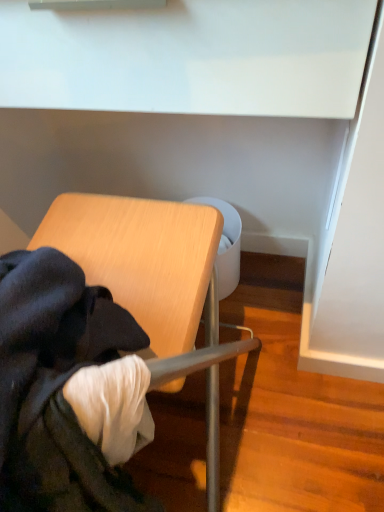
This screenshot has height=512, width=384. In order to click on wooden desk at lower left in this screenshot , I will do [x=141, y=258].

The width and height of the screenshot is (384, 512). What do you see at coordinates (141, 258) in the screenshot? I see `wooden desk at lower left` at bounding box center [141, 258].

What is the approximate width of wooden desk at lower left?

The width of wooden desk at lower left is 13.95 inches.

Locate an element on the screen. wooden desk at lower left is located at coordinates (141, 258).